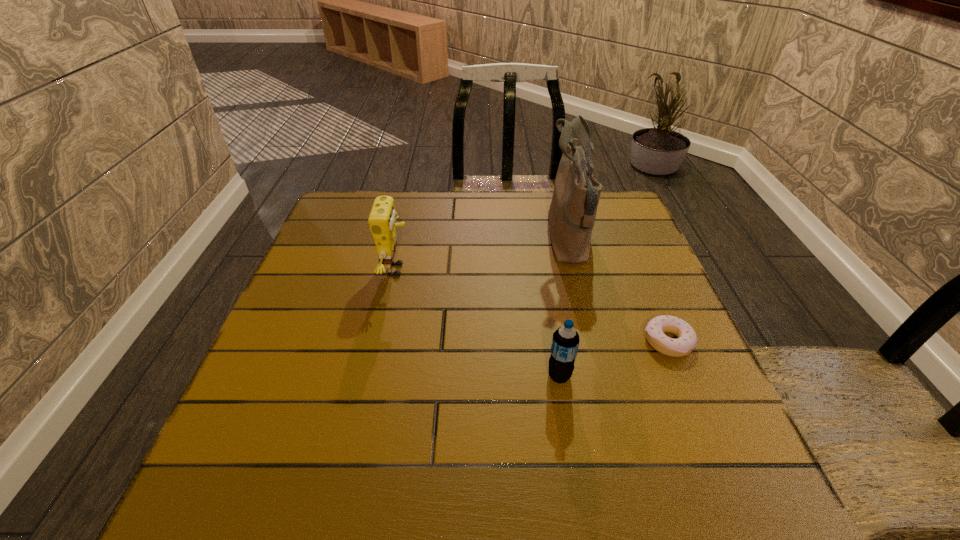
I want to click on the tallest object, so click(x=572, y=212).

This screenshot has width=960, height=540. Find the location of `the leftmost object`. the leftmost object is located at coordinates (382, 218).

Image resolution: width=960 pixels, height=540 pixels. I want to click on the second tallest object, so click(382, 218).

Where is `the second shortest object`? the second shortest object is located at coordinates (565, 342).

Locate an element on the screen. This screenshot has width=960, height=540. soda bottle is located at coordinates (565, 342).

Where is `doughnut`? The height and width of the screenshot is (540, 960). doughnut is located at coordinates (687, 339).

The image size is (960, 540). Find the location of `the shortest object`. the shortest object is located at coordinates (687, 339).

Locate an element on the screen. free region located 0.300m on the front-facing side of the shoulder bag is located at coordinates (433, 239).

Where is `free location located 0.230m on the front-facing side of the shoulder bag`? This screenshot has height=540, width=960. free location located 0.230m on the front-facing side of the shoulder bag is located at coordinates (459, 239).

This screenshot has width=960, height=540. Identify the location of vacant space located 0.180m on the front-facing side of the shoulder bag. (478, 239).